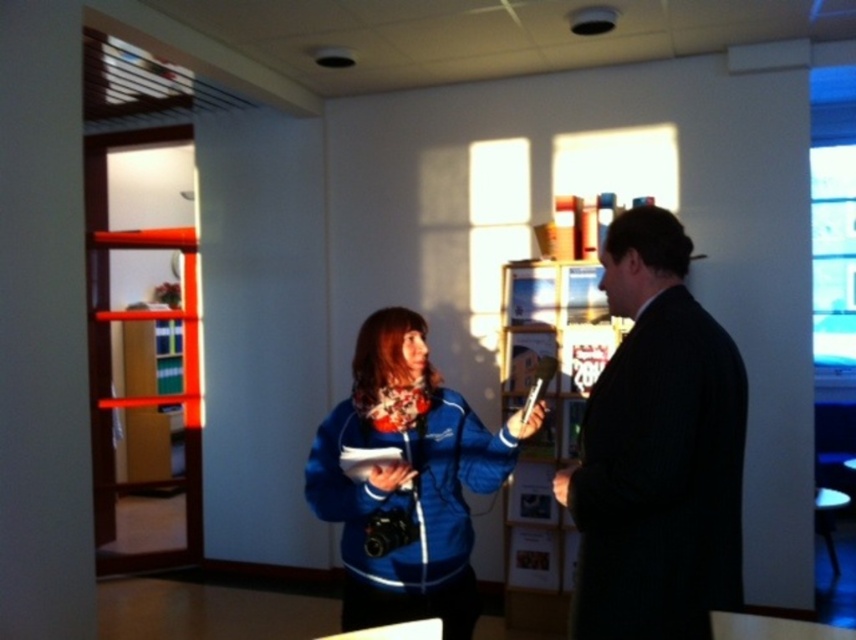
Who is taller, blue fabric jacket at center or dark suit at center?

blue fabric jacket at center

This screenshot has width=856, height=640. What do you see at coordinates (660, 449) in the screenshot?
I see `blue fabric jacket at center` at bounding box center [660, 449].

This screenshot has width=856, height=640. Find the location of `blue fabric jacket at center`. blue fabric jacket at center is located at coordinates (660, 449).

Can you confirm if blue fleece jacket at center is positioned to the left of wooden bookshelf at center?

Indeed, blue fleece jacket at center is positioned on the left side of wooden bookshelf at center.

What do you see at coordinates (406, 481) in the screenshot?
I see `blue fleece jacket at center` at bounding box center [406, 481].

The width and height of the screenshot is (856, 640). What do you see at coordinates (406, 481) in the screenshot? I see `blue fleece jacket at center` at bounding box center [406, 481].

Where is `blue fleece jacket at center`? Image resolution: width=856 pixels, height=640 pixels. blue fleece jacket at center is located at coordinates (406, 481).

Can you confirm if blue fabric jacket at center is thinner than wooden bookshelf at center?

Incorrect, blue fabric jacket at center's width is not less than wooden bookshelf at center's.

Between blue fabric jacket at center and wooden bookshelf at center, which one appears on the right side from the viewer's perspective?

From the viewer's perspective, wooden bookshelf at center appears more on the right side.

Measure the distance between blue fabric jacket at center and camera.

blue fabric jacket at center and camera are 5.09 feet apart from each other.

Identify the location of blue fabric jacket at center. This screenshot has height=640, width=856. (660, 449).